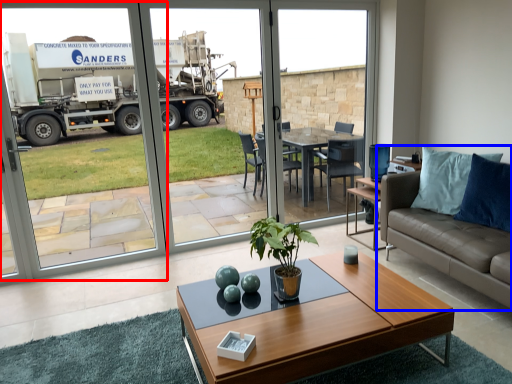
Question: Which object is further to the camera taking this photo, screen door (highlighted by a red box) or studio couch (highlighted by a blue box)?

Choices:
 (A) screen door
 (B) studio couch

Answer: (A)